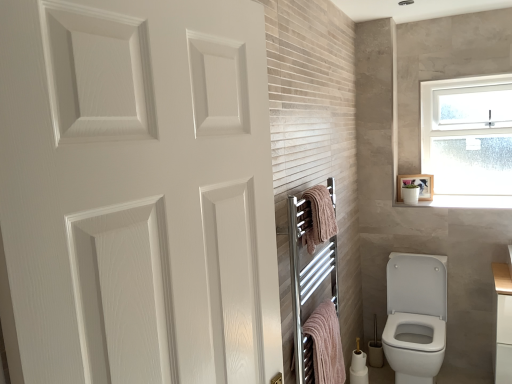
Question: Is white glossy medicine cabinet at upper right positioned with its back to white glossy toilet at lower right?

Choices:
 (A) yes
 (B) no

Answer: (B)

Question: From a real-world perspective, is white glossy medicine cabinet at upper right located higher than white glossy toilet at lower right?

Choices:
 (A) no
 (B) yes

Answer: (B)

Question: Would you say white glossy medicine cabinet at upper right contains white glossy toilet at lower right?

Choices:
 (A) no
 (B) yes

Answer: (A)

Question: Can you confirm if white glossy medicine cabinet at upper right is smaller than white glossy toilet at lower right?

Choices:
 (A) yes
 (B) no

Answer: (A)

Question: Is white glossy medicine cabinet at upper right shorter than white glossy toilet at lower right?

Choices:
 (A) no
 (B) yes

Answer: (B)

Question: From the image's perspective, is pink fabric towel at center, acting as the second bath towel starting from the bottom, above or below white frosted glass window at upper right?

Choices:
 (A) above
 (B) below

Answer: (B)

Question: Is pink fabric towel at center, acting as the second bath towel starting from the bottom, situated inside white frosted glass window at upper right or outside?

Choices:
 (A) inside
 (B) outside

Answer: (B)

Question: In the image, is pink fabric towel at center, the 1th bath towel when ordered from top to bottom, on the left side or the right side of white frosted glass window at upper right?

Choices:
 (A) right
 (B) left

Answer: (B)

Question: Looking at their shapes, would you say pink fabric towel at center, the 1th bath towel when ordered from top to bottom, is wider or thinner than white frosted glass window at upper right?

Choices:
 (A) wide
 (B) thin

Answer: (B)

Question: From their relative heights in the image, would you say chrome towel rack at center is taller or shorter than pink fabric towel at center, the 1th bath towel when ordered from top to bottom?

Choices:
 (A) short
 (B) tall

Answer: (B)

Question: In terms of width, does chrome towel rack at center look wider or thinner when compared to pink fabric towel at center, the 1th bath towel when ordered from top to bottom?

Choices:
 (A) wide
 (B) thin

Answer: (B)

Question: From a real-world perspective, relative to pink fabric towel at center, acting as the second bath towel starting from the bottom, is chrome towel rack at center vertically above or below?

Choices:
 (A) above
 (B) below

Answer: (B)

Question: Is chrome towel rack at center bigger or smaller than pink fabric towel at center, acting as the second bath towel starting from the bottom?

Choices:
 (A) big
 (B) small

Answer: (A)

Question: Based on their positions, is white matte door at upper left located to the left or right of white glossy toilet paper at lower right, which is the first toilet paper from bottom to top?

Choices:
 (A) left
 (B) right

Answer: (A)

Question: Would you say white matte door at upper left is inside or outside white glossy toilet paper at lower right, which is the first toilet paper from bottom to top?

Choices:
 (A) inside
 (B) outside

Answer: (B)